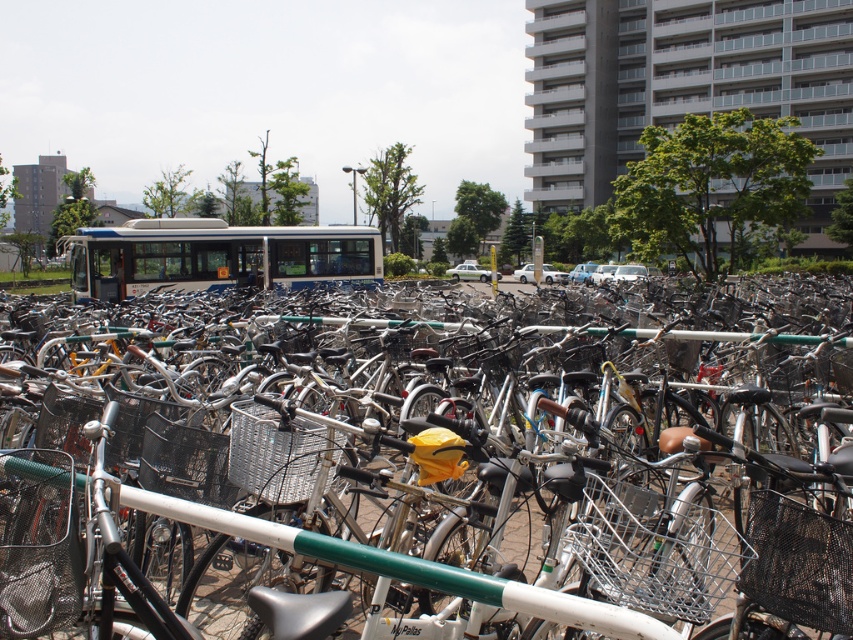
Question: Which of the following is the closest to the observer?

Choices:
 (A) (157, 269)
 (B) (355, 513)

Answer: (B)

Question: Which of the following is the farthest from the observer?

Choices:
 (A) white matte bus at center
 (B) silver metallic bicycle at center

Answer: (A)

Question: Is silver metallic bicycle at center behind white matte bus at center?

Choices:
 (A) no
 (B) yes

Answer: (A)

Question: Does silver metallic bicycle at center appear on the left side of white matte bus at center?

Choices:
 (A) no
 (B) yes

Answer: (A)

Question: Is silver metallic bicycle at center smaller than white matte bus at center?

Choices:
 (A) no
 (B) yes

Answer: (B)